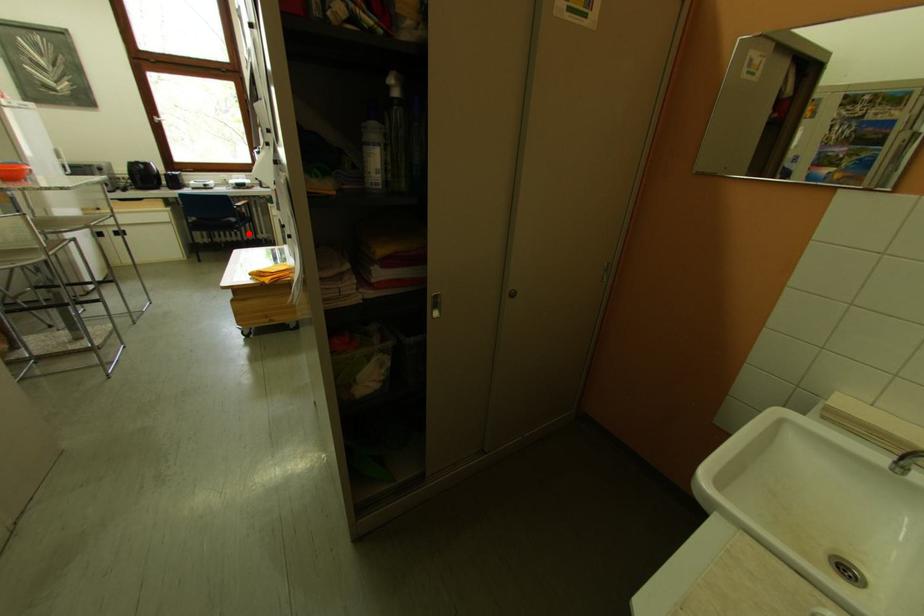
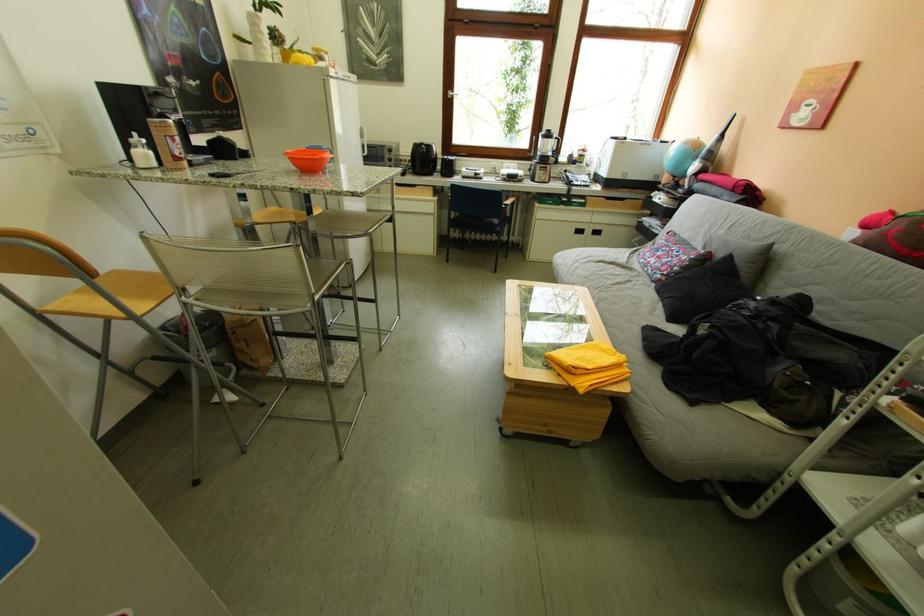
Question: I am providing you with two images of the same scene from different viewpoints. Image1 has a red point marked. In image2, the corresponding 3D location appears at what relative position? Reply with the corresponding letter.

Choices:
 (A) Closer
 (B) Farther

Answer: (A)